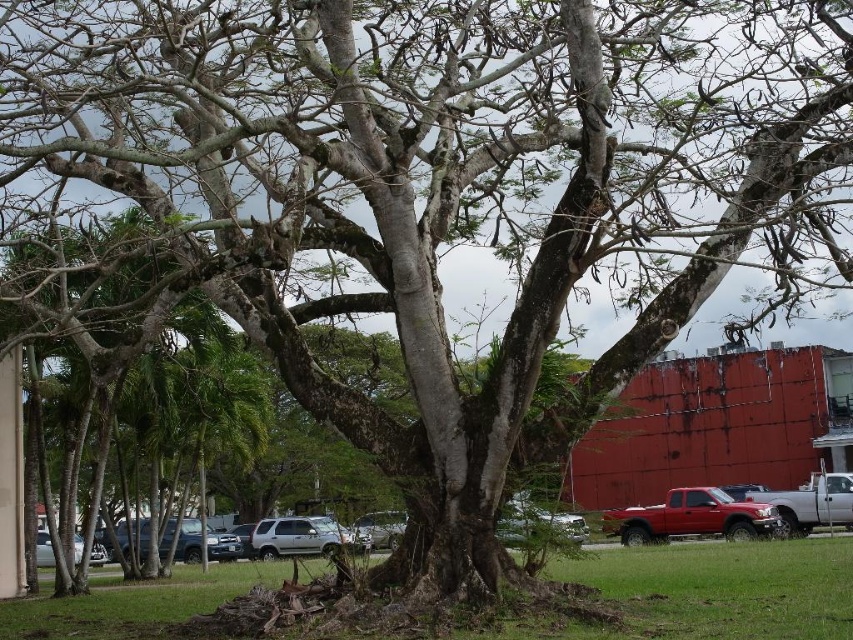
You are standing at the edge of the parking lot and want to walk to the tree. Which object, the green grass at center or the silver metallic car at lower left, would you have to step over first?

The silver metallic car at lower left is closer to you, so you would have to step over it first before reaching the green grass at center.